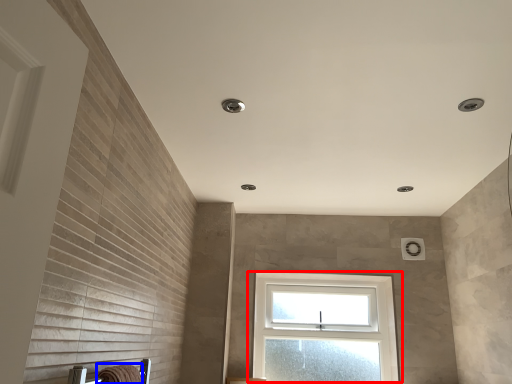
Question: Which of the following is the farthest to the observer, window (highlighted by a red box) or bath towel (highlighted by a blue box)?

Choices:
 (A) window
 (B) bath towel

Answer: (A)